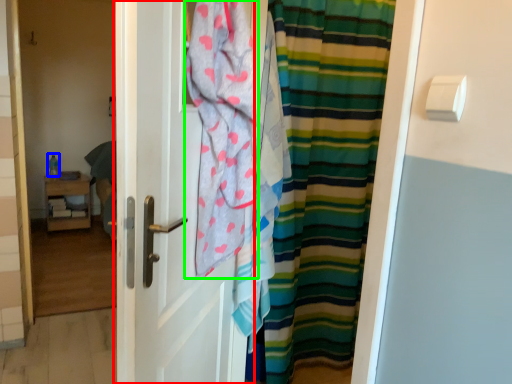
Question: Estimate the real-world distances between objects in this image. Which object is farther from door (highlighted by a red box), teal (highlighted by a blue box) or beach towel (highlighted by a green box)?

Choices:
 (A) teal
 (B) beach towel

Answer: (A)